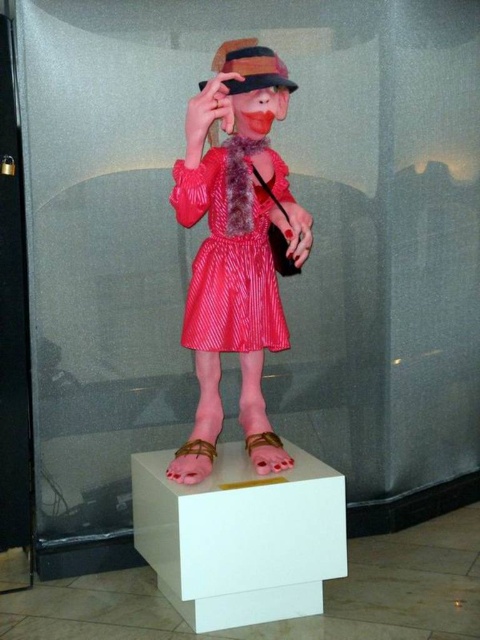
Identify the location of striped felt hat at upper center. This screenshot has width=480, height=640. (251, 67).

What do you see at coordinates (251, 67) in the screenshot? I see `striped felt hat at upper center` at bounding box center [251, 67].

Which is behind, point (219, 58) or point (204, 445)?

The point (204, 445) is more distant.

I want to click on striped felt hat at upper center, so click(251, 67).

Based on the photo, is white matte box at center above shiny satin dress at center?

Incorrect, white matte box at center is not positioned above shiny satin dress at center.

Can you confirm if white matte box at center is taller than shiny satin dress at center?

No, white matte box at center is not taller than shiny satin dress at center.

Is point (163, 577) positioned in front of point (220, 157)?

No, (163, 577) is further to viewer.

Where is `white matte box at center`? The height and width of the screenshot is (640, 480). white matte box at center is located at coordinates (240, 538).

Can you confirm if shiny pink dress at center is thinner than striped felt hat at upper center?

Incorrect, shiny pink dress at center's width is not less than striped felt hat at upper center's.

Is point (259, 406) positioned before point (274, 51)?

That is False.

Locate an element on the screen. shiny pink dress at center is located at coordinates (237, 227).